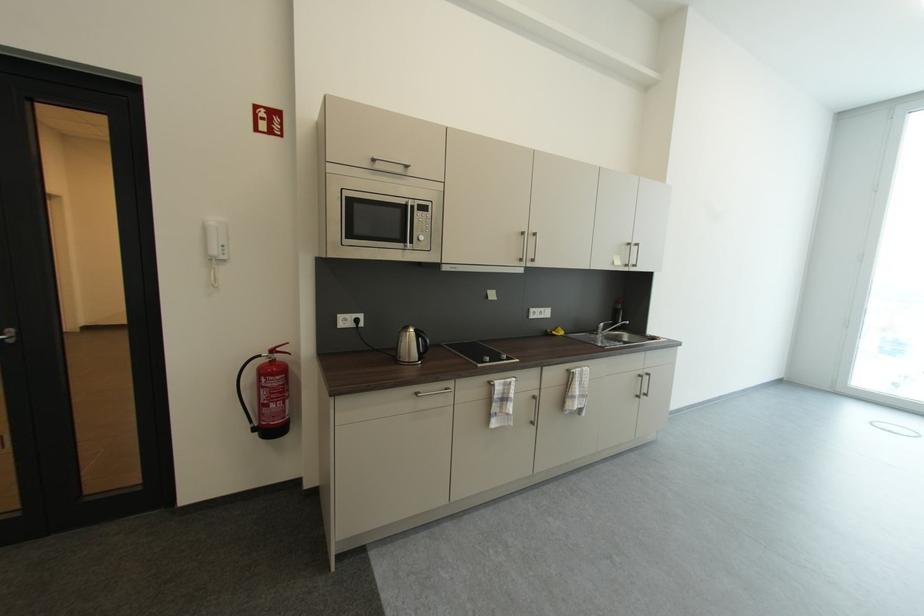
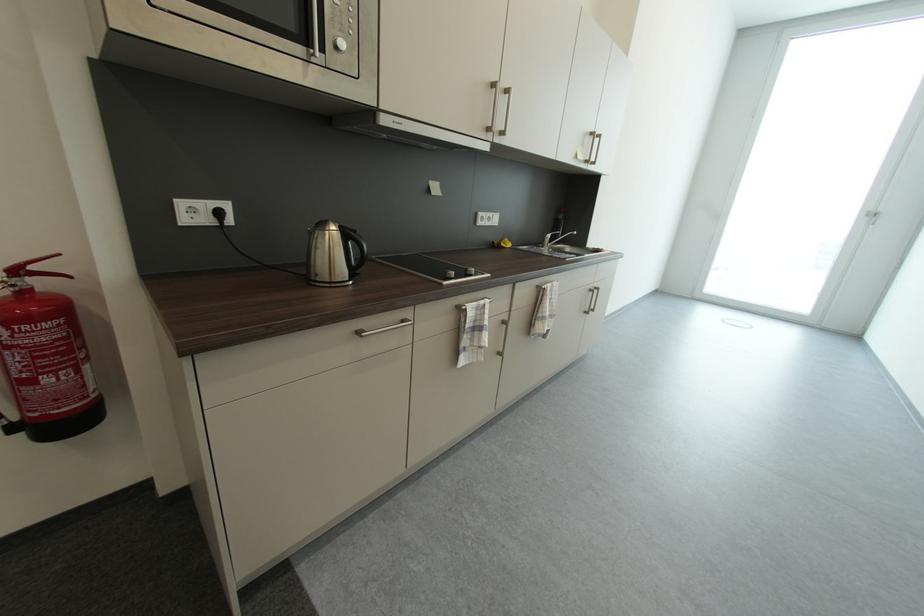
Find the pixel in the second image that matches pixel 428 233 in the first image.

(347, 33)